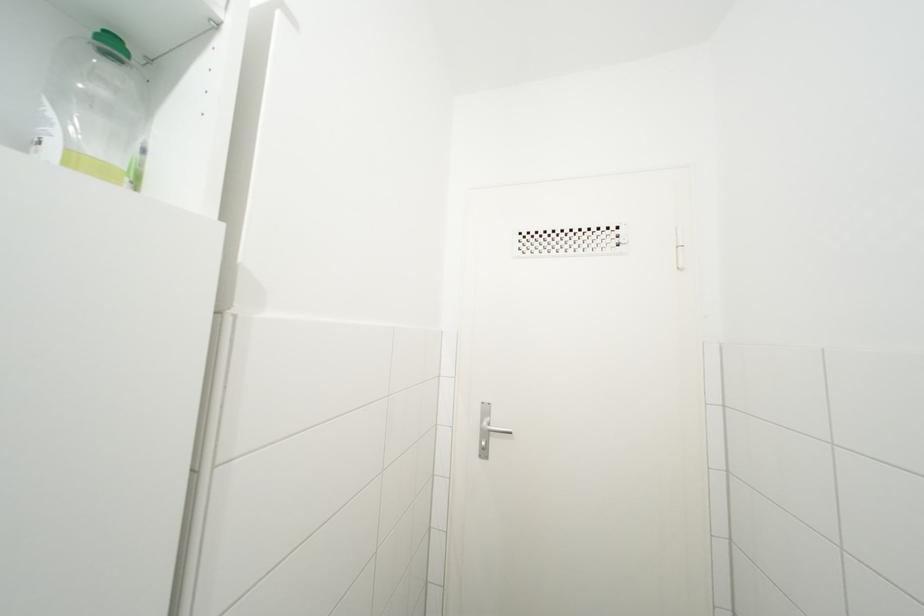
What do you see at coordinates (494, 432) in the screenshot? This screenshot has height=616, width=924. I see `the silver door handle` at bounding box center [494, 432].